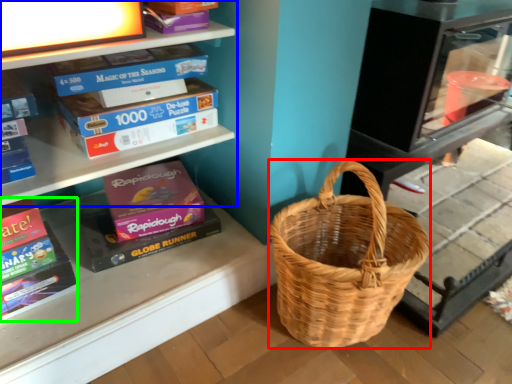
Question: Considering the real-world distances, which object is farthest from picnic basket (highlighted by a red box)? shelf (highlighted by a blue box) or paperback book (highlighted by a green box)?

Choices:
 (A) shelf
 (B) paperback book

Answer: (B)